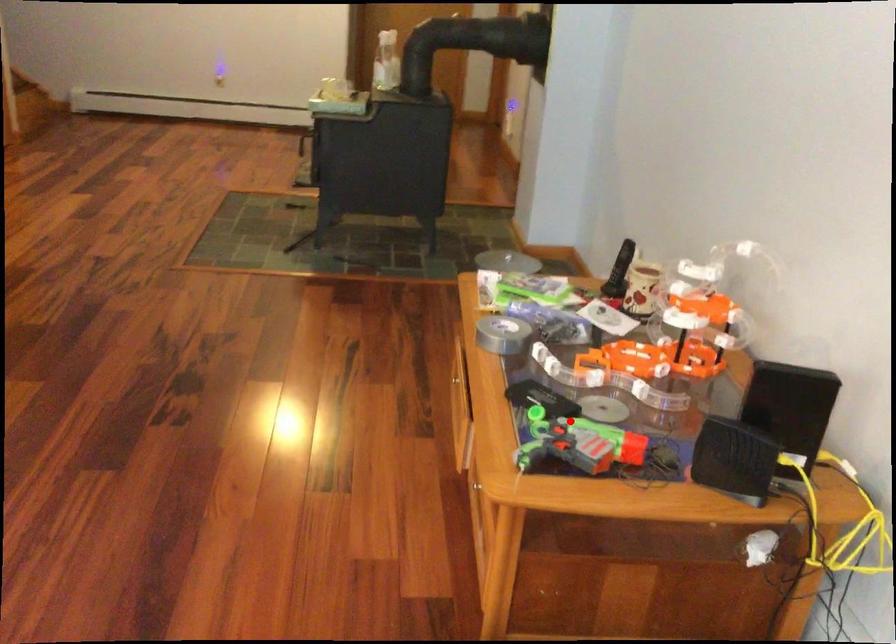
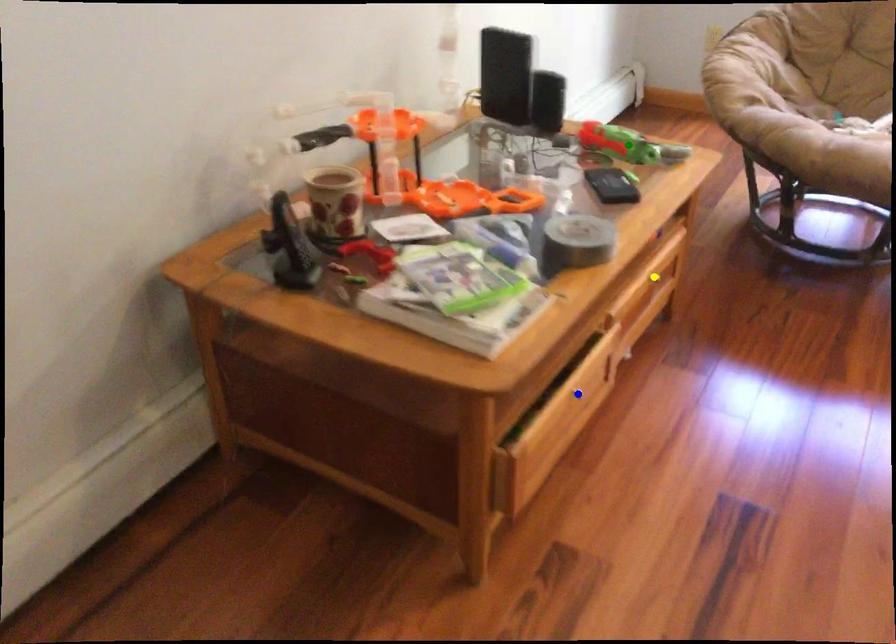
Question: I am providing you with two images of the same scene from different viewpoints. A red point is marked on the first image. You are given multiple points on the second image. Which mark in image 2 goes with the point in image 1?

Choices:
 (A) green point
 (B) yellow point
 (C) blue point

Answer: (A)